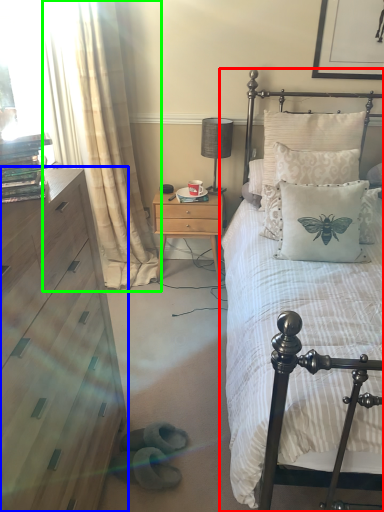
Question: Estimate the real-world distances between objects in this image. Which object is closer to bed (highlighted by a red box), chest of drawers (highlighted by a blue box) or curtain (highlighted by a green box)?

Choices:
 (A) chest of drawers
 (B) curtain

Answer: (A)